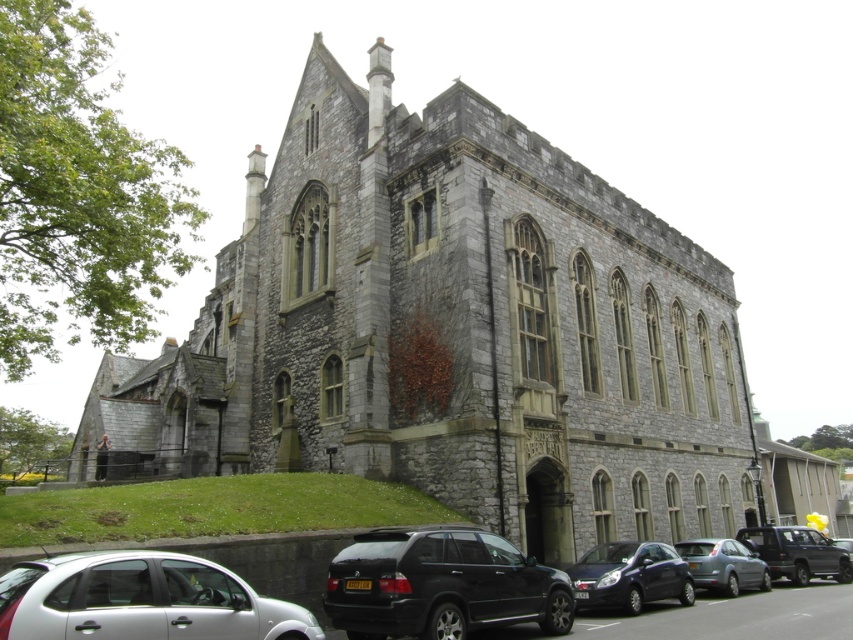
You are a delivery driver who needs to park your truck between the white matte hatchback at lower left and the dark blue metallic car at lower center. The truck is 20 feet long. Can you fit your truck between them without overlapping either vehicle?

The distance between the white matte hatchback at lower left and the dark blue metallic car at lower center is 76.49 feet. Since the truck is only 20 feet long, there is sufficient space to park it between them without overlapping either vehicle.

You are a visitor arriving at the historic stone building and need to park your car. You see a black matte suv at lower center and a dark blue metallic car at lower center. Which parking spot is more accessible to you if you want to park closer to the entrance?

The black matte suv at lower center is closer to the viewer than the dark blue metallic car at lower center, so the parking spot near the black matte suv at lower center is more accessible and closer to the entrance.

Based on the photo, you are a delivery person needing to park your vehicle in the parking lot near the historic stone building. The parking space available is only 1.5 meters tall. Which vehicle between the dark blue metallic car at lower center and the metallic gray suv at lower right can you safely park there?

The dark blue metallic car at lower center has a lesser height compared to the metallic gray suv at lower right, so the dark blue metallic car at lower center can be safely parked in the 1.5 meters tall parking space since it is shorter than the SUV.